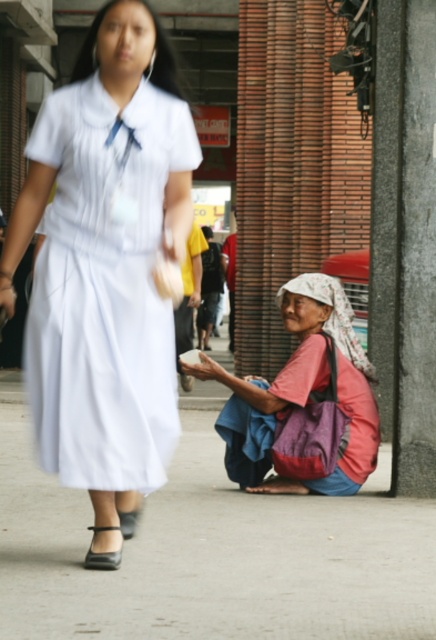
Is point (190, 444) farther from viewer compared to point (128, 237)?

Yes, point (190, 444) is behind point (128, 237).

This screenshot has height=640, width=436. What do you see at coordinates (211, 552) in the screenshot?
I see `smooth concrete pavement at lower center` at bounding box center [211, 552].

This screenshot has width=436, height=640. What are the coordinates of `smooth concrete pavement at lower center` in the screenshot? It's located at (211, 552).

Is point (64, 396) more distant than point (88, 563)?

No.

You are a GUI agent. You are given a task and a screenshot of the screen. Output one action in this format:
    pyautogui.click(x=<x>, y=<y>)
    Task: Click on the white pleated dress at left
    This screenshot has height=640, width=436.
    Given the screenshot: What is the action you would take?
    pyautogui.click(x=105, y=288)

The image size is (436, 640). Identify the location of white pleated dress at left. (105, 288).

Can you confirm if red fabric bag at lower right is smaller than black leather sandal at lower left?

Incorrect, red fabric bag at lower right is not smaller in size than black leather sandal at lower left.

Looking at this image, can you confirm if red fabric bag at lower right is positioned below black leather sandal at lower left?

No, red fabric bag at lower right is not below black leather sandal at lower left.

Identify the location of red fabric bag at lower right. (303, 401).

Where is `red fabric bag at lower right`? The image size is (436, 640). red fabric bag at lower right is located at coordinates (303, 401).